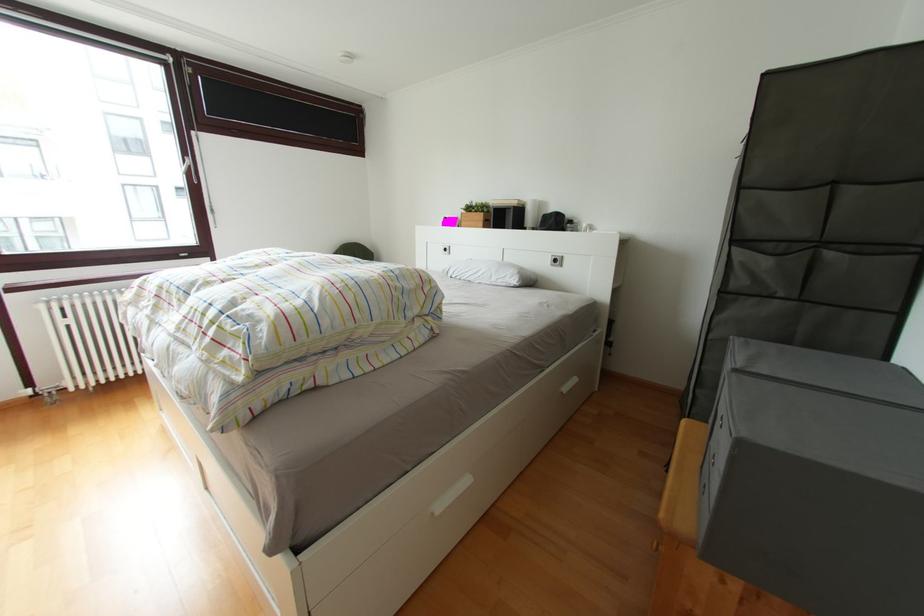
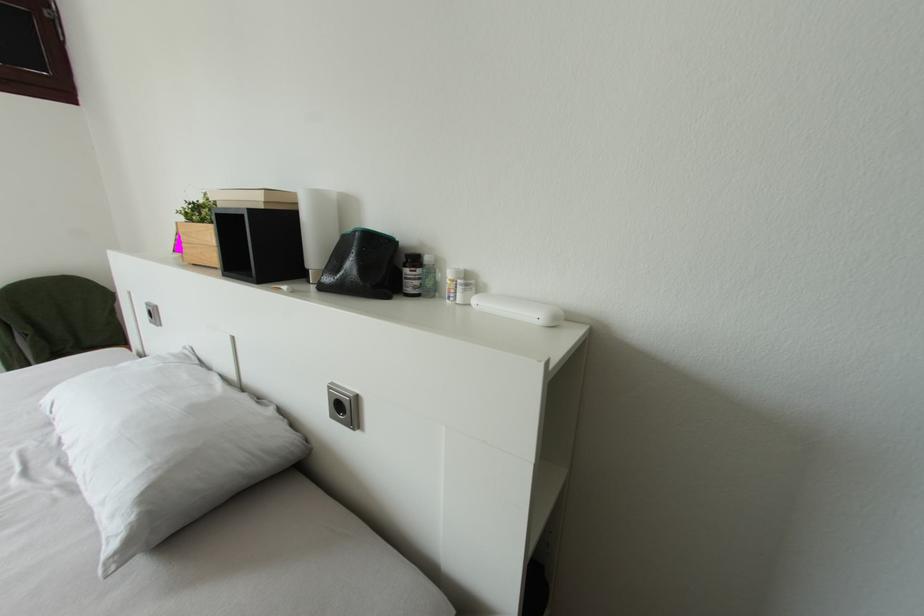
What movement of the cameraman would produce the second image?

The cameraman walked toward right, forward.